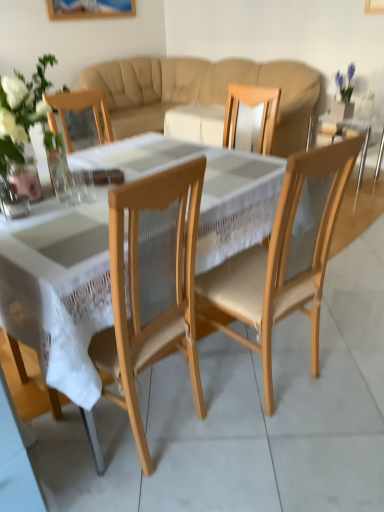
In order to click on free spot to the right of clear glass at center, which is the 1th tableware from left to right in this screenshot , I will do `click(96, 204)`.